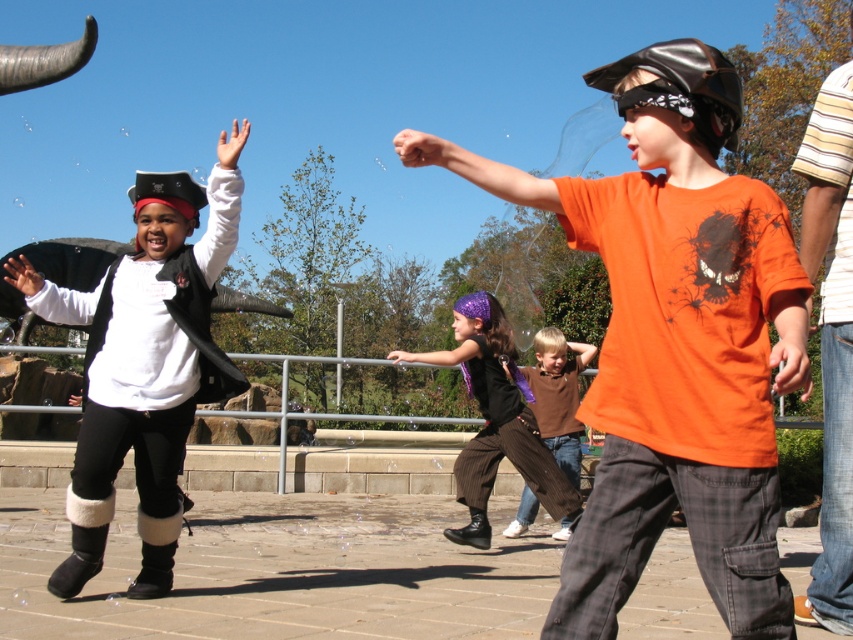
Is orange matte shirt at center taller than black pinstripe pants at center?

Yes.

Does orange matte shirt at center lie behind black pinstripe pants at center?

No, orange matte shirt at center is in front of black pinstripe pants at center.

Is point (657, 352) positioned after point (469, 348)?

No, (657, 352) is in front of (469, 348).

What are the coordinates of `orange matte shirt at center` in the screenshot? It's located at (672, 340).

What are the coordinates of `matte black vest at left` in the screenshot? It's located at (143, 369).

Is matte black vest at left taller than black pinstripe pants at center?

Yes.

Does point (165, 317) come in front of point (426, 358)?

Yes, it is in front of point (426, 358).

The image size is (853, 640). I want to click on matte black vest at left, so click(x=143, y=369).

Can you confirm if black pinstripe pants at center is thinner than brown cotton shirt at center?

No, black pinstripe pants at center is not thinner than brown cotton shirt at center.

Is black pinstripe pants at center smaller than brown cotton shirt at center?

Actually, black pinstripe pants at center might be larger than brown cotton shirt at center.

The image size is (853, 640). What do you see at coordinates (495, 419) in the screenshot?
I see `black pinstripe pants at center` at bounding box center [495, 419].

Locate an element on the screen. black pinstripe pants at center is located at coordinates (495, 419).